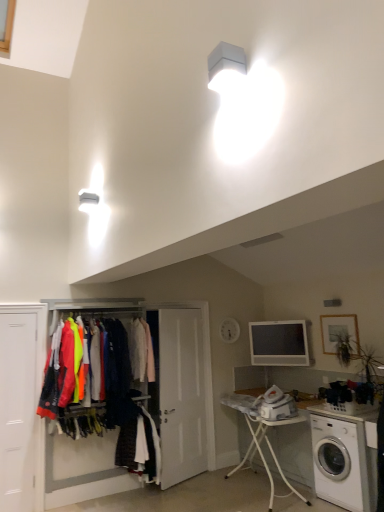
Question: Is matte gray monitor at center thinner than white plastic ironing board at lower center?

Choices:
 (A) yes
 (B) no

Answer: (A)

Question: Does matte gray monitor at center appear on the right side of white plastic ironing board at lower center?

Choices:
 (A) yes
 (B) no

Answer: (A)

Question: Is matte gray monitor at center oriented towards white plastic ironing board at lower center?

Choices:
 (A) yes
 (B) no

Answer: (B)

Question: Is matte gray monitor at center turned away from white plastic ironing board at lower center?

Choices:
 (A) no
 (B) yes

Answer: (A)

Question: Is matte gray monitor at center taller than white plastic ironing board at lower center?

Choices:
 (A) yes
 (B) no

Answer: (B)

Question: Does matte gray monitor at center touch white plastic ironing board at lower center?

Choices:
 (A) no
 (B) yes

Answer: (A)

Question: Does white plastic washing machine at lower right have a smaller size compared to white plastic ironing board at lower center?

Choices:
 (A) no
 (B) yes

Answer: (B)

Question: From the image's perspective, is white plastic washing machine at lower right over white plastic ironing board at lower center?

Choices:
 (A) no
 (B) yes

Answer: (B)

Question: From a real-world perspective, is white plastic washing machine at lower right physically below white plastic ironing board at lower center?

Choices:
 (A) yes
 (B) no

Answer: (A)

Question: Is white plastic washing machine at lower right located outside white plastic ironing board at lower center?

Choices:
 (A) yes
 (B) no

Answer: (A)

Question: Is white plastic washing machine at lower right positioned far away from white plastic ironing board at lower center?

Choices:
 (A) yes
 (B) no

Answer: (B)

Question: Considering the relative positions of white plastic washing machine at lower right and white plastic ironing board at lower center in the image provided, is white plastic washing machine at lower right behind white plastic ironing board at lower center?

Choices:
 (A) yes
 (B) no

Answer: (B)

Question: Is neon fabric jackets at center, which is the second clothing from bottom to top, to the left of white plastic ironing board at lower center from the viewer's perspective?

Choices:
 (A) no
 (B) yes

Answer: (B)